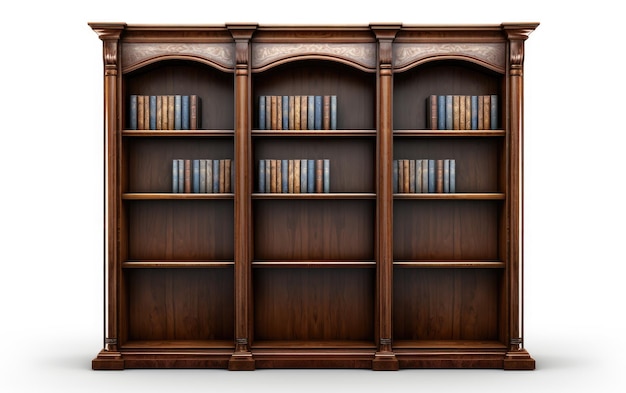
Where is `books on top right shelf`? This screenshot has height=393, width=626. books on top right shelf is located at coordinates (433, 101), (441, 119), (447, 111), (454, 119), (459, 112), (466, 118), (471, 110), (480, 118), (485, 106), (491, 113).